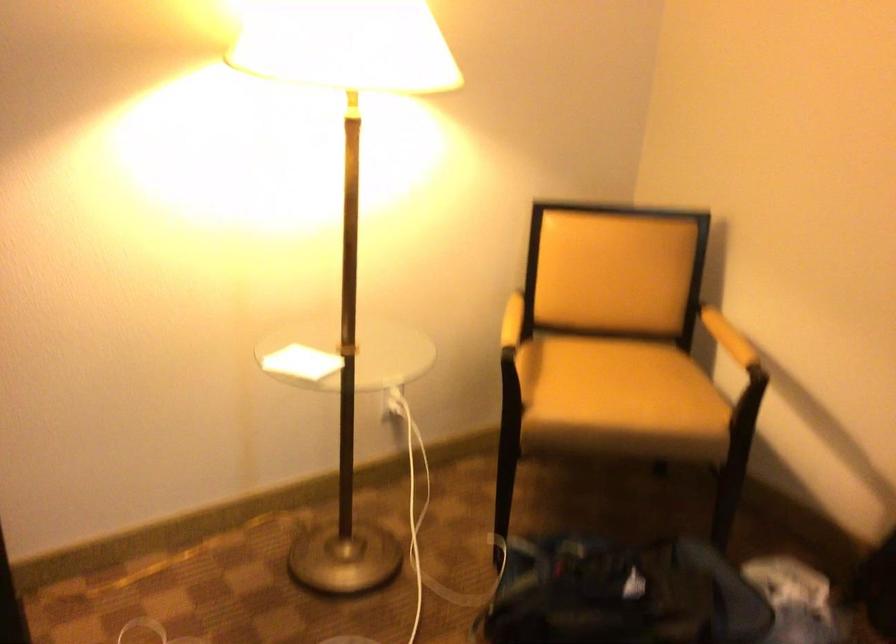
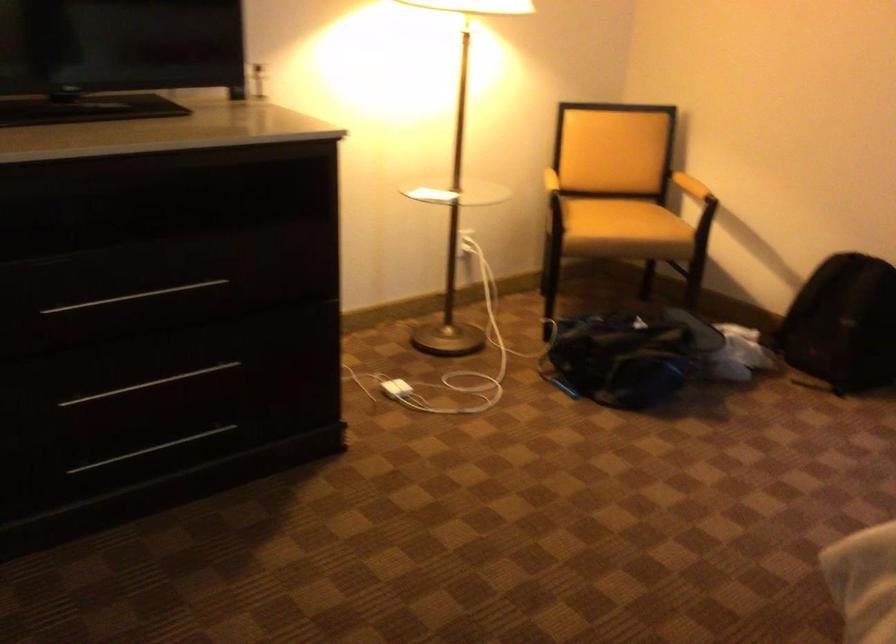
Based on the photo, which direction would the cameraman need to move to produce the second image?

The cameraman moved toward left, backward.